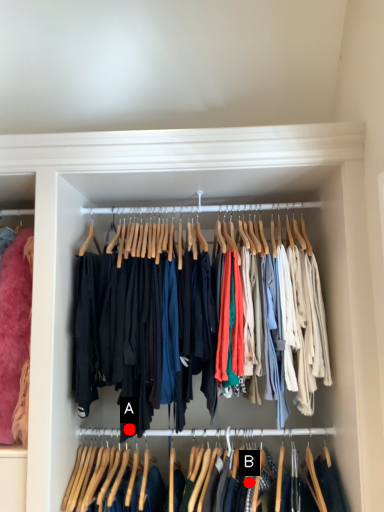
Question: Two points are circled on the image, labeled by A and B beside each circle. Which point is closer to the camera?

Choices:
 (A) A is closer
 (B) B is closer

Answer: (B)